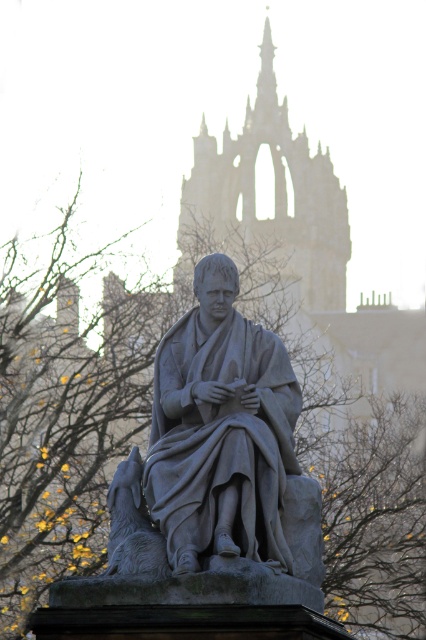
Can you confirm if gray stone statue at center is positioned above stone spire at center?

Actually, gray stone statue at center is below stone spire at center.

Is gray stone statue at center taller than stone spire at center?

In fact, gray stone statue at center may be shorter than stone spire at center.

Which is in front, point (262, 333) or point (273, 99)?

Positioned in front is point (262, 333).

Find the location of a particular element. gray stone statue at center is located at coordinates (221, 429).